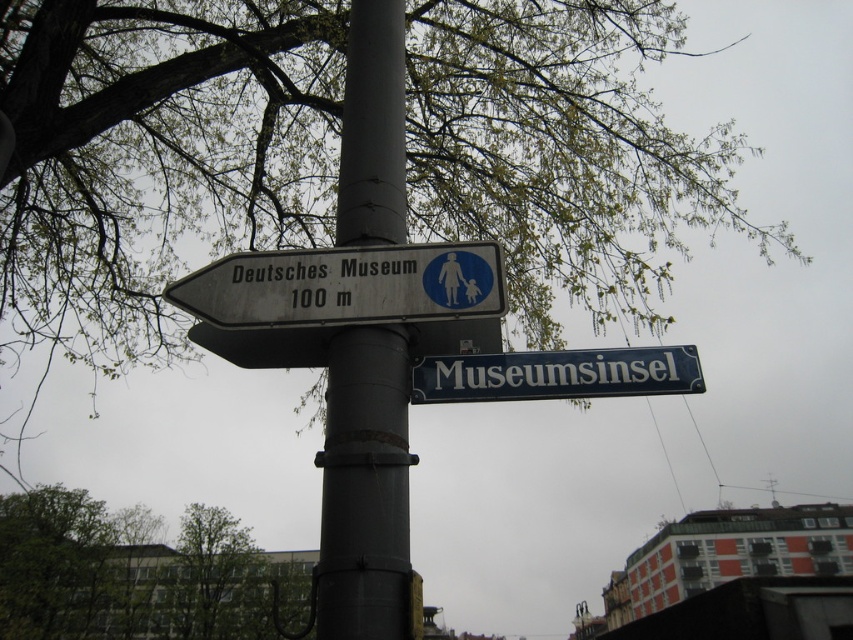
Question: Observing the image, what is the correct spatial positioning of green leafy tree at upper left in reference to white metallic sign at upper left?

Choices:
 (A) below
 (B) above

Answer: (A)

Question: Can you confirm if green leafy tree at upper left is bigger than metallic pole at center?

Choices:
 (A) no
 (B) yes

Answer: (B)

Question: Does green leafy tree at upper left appear under metallic pole at center?

Choices:
 (A) no
 (B) yes

Answer: (B)

Question: Which is nearer to the metallic pole at center?

Choices:
 (A) green leafy tree at upper left
 (B) white plastic sign at center

Answer: (B)

Question: Among these points, which one is farthest from the camera?

Choices:
 (A) (624, 348)
 (B) (358, 205)
 (C) (577, 92)

Answer: (C)

Question: Which point is farther to the camera?

Choices:
 (A) white plastic sign at center
 (B) green leafy tree at upper left

Answer: (B)